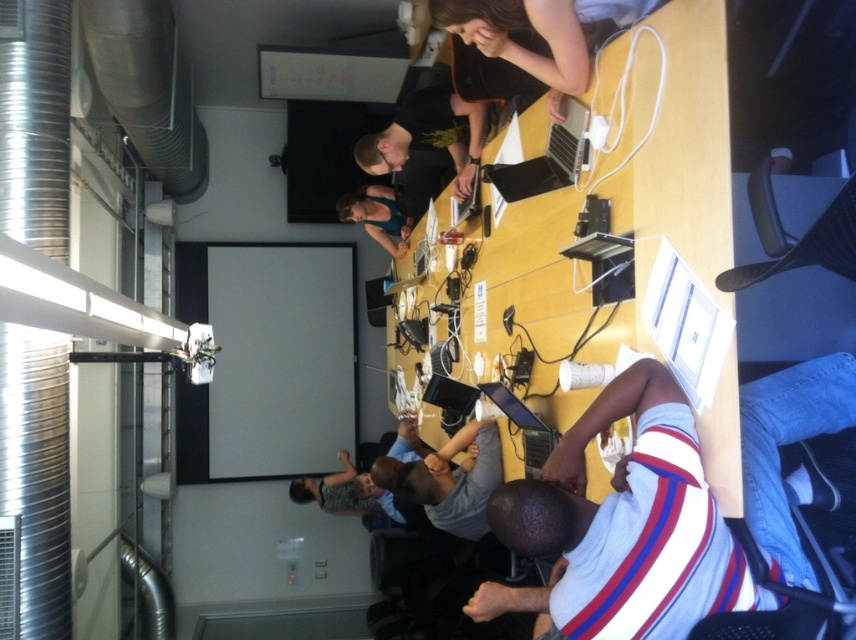
Between point (419, 474) and point (383, 493), which one is positioned in front?

Positioned in front is point (419, 474).

Which is behind, point (409, 518) or point (397, 509)?

Positioned behind is point (397, 509).

Locate an element on the screen. gray fabric shirt at center is located at coordinates (444, 477).

In the scene shown: Between gray fabric shirt at center and teal fabric shirt at center, which one is positioned higher?

teal fabric shirt at center is higher up.

Can you confirm if gray fabric shirt at center is positioned to the left of teal fabric shirt at center?

No, gray fabric shirt at center is not to the left of teal fabric shirt at center.

Is point (497, 476) more distant than point (369, 234)?

No, it is not.

Where is `gray fabric shirt at center`? This screenshot has height=640, width=856. gray fabric shirt at center is located at coordinates (444, 477).

Is matte black laptop at upper center below striped jersey at center?

No, matte black laptop at upper center is not below striped jersey at center.

Between matte black laptop at upper center and striped jersey at center, which one has more height?

With more height is striped jersey at center.

Does point (507, 17) lie in front of point (354, 483)?

That is True.

In order to click on matte black laptop at upper center in this screenshot , I will do `click(541, 35)`.